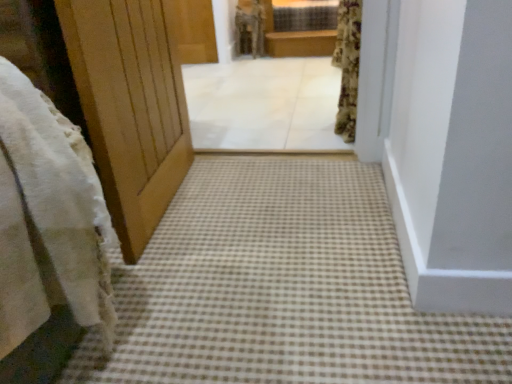
What do you see at coordinates (348, 66) in the screenshot? The height and width of the screenshot is (384, 512). I see `fluffy floral curtain at upper right` at bounding box center [348, 66].

Locate an element on the screen. white fluffy robe at upper center is located at coordinates (249, 28).

What are the coordinates of `white tile floor at center` in the screenshot? It's located at (264, 104).

Identify the location of plaid fabric window at upper center. This screenshot has height=384, width=512. (304, 15).

What is the approximate width of brown checkered carpet at center?

The width of brown checkered carpet at center is 1.49 meters.

The width and height of the screenshot is (512, 384). Identify the location of brown wooden balustrade at upper center. (300, 43).

Identify the location of fluffy floral curtain at upper right. (348, 66).

Is brown wooden balustrade at upper center far from brown checkered carpet at center?

Yes.

Choose the correct answer: Is brown wooden balustrade at upper center inside brown checkered carpet at center or outside it?

brown wooden balustrade at upper center is not inside brown checkered carpet at center, it's outside.

The width and height of the screenshot is (512, 384). I want to click on path below the brown wooden balustrade at upper center (from a real-world perspective), so click(x=283, y=288).

Can you confirm if brown wooden balustrade at upper center is bigger than brown checkered carpet at center?

Actually, brown wooden balustrade at upper center might be smaller than brown checkered carpet at center.

From a real-world perspective, is plaid fabric window at upper center under fluffy floral curtain at upper right?

No, from a real-world perspective, plaid fabric window at upper center is not below fluffy floral curtain at upper right.

Is plaid fabric window at upper center positioned beyond the bounds of fluffy floral curtain at upper right?

Absolutely, plaid fabric window at upper center is external to fluffy floral curtain at upper right.

The height and width of the screenshot is (384, 512). Find the location of `curtain below the plaid fabric window at upper center (from the image's perspective)`. curtain below the plaid fabric window at upper center (from the image's perspective) is located at coordinates (348, 66).

Considering their positions, is plaid fabric window at upper center located in front of or behind fluffy floral curtain at upper right?

Visually, plaid fabric window at upper center is located behind fluffy floral curtain at upper right.

Locate an element on the screen. The height and width of the screenshot is (384, 512). corridor below the brown wooden balustrade at upper center (from the image's perspective) is located at coordinates (264, 104).

Is brown wooden balustrade at upper center outside of white tile floor at center?

Yes.

Does brown wooden balustrade at upper center touch white tile floor at center?

brown wooden balustrade at upper center is not next to white tile floor at center, and they're not touching.

From the picture: Between brown wooden balustrade at upper center and white tile floor at center, which one has more height?

brown wooden balustrade at upper center.

In the scene shown: Can we say white tile floor at center lies outside brown checkered carpet at center?

Yes.

From a real-world perspective, between white tile floor at center and brown checkered carpet at center, who is vertically lower?

From a 3D spatial view, brown checkered carpet at center is below.

Identify the location of path on the right of white tile floor at center. The width and height of the screenshot is (512, 384). (283, 288).

Does white tile floor at center lie behind brown checkered carpet at center?

Yes, white tile floor at center is further from the viewer.

How distant is white tile floor at center from brown wooden balustrade at upper center?

white tile floor at center and brown wooden balustrade at upper center are 37.37 inches apart from each other.

Can you confirm if white tile floor at center is shorter than brown wooden balustrade at upper center?

Yes, white tile floor at center is shorter than brown wooden balustrade at upper center.

Is white tile floor at center inside the boundaries of brown wooden balustrade at upper center, or outside?

white tile floor at center is not inside brown wooden balustrade at upper center, it's outside.

Considering the positions of point (274, 142) and point (286, 36), is point (274, 142) closer or farther from the camera than point (286, 36)?

Point (274, 142) is positioned closer to the camera compared to point (286, 36).

The image size is (512, 384). In order to click on window that is above the white fluffy robe at upper center (from a real-world perspective) in this screenshot , I will do `click(304, 15)`.

Measure the distance from white fluffy robe at upper center to plaid fabric window at upper center.

12.41 inches.

Which object is positioned more to the left, white fluffy robe at upper center or plaid fabric window at upper center?

From the viewer's perspective, white fluffy robe at upper center appears more on the left side.

Which is correct: white fluffy robe at upper center is inside plaid fabric window at upper center, or outside of it?

white fluffy robe at upper center cannot be found inside plaid fabric window at upper center.

Could plaid fabric window at upper center be considered to be inside white tile floor at center?

That's incorrect, plaid fabric window at upper center is not inside white tile floor at center.

Which is nearer, (230, 123) or (329, 3)?

Point (230, 123) appears to be closer to the viewer than point (329, 3).

Considering the positions of objects white tile floor at center and plaid fabric window at upper center in the image provided, who is more to the left, white tile floor at center or plaid fabric window at upper center?

white tile floor at center.

What's the angular difference between white tile floor at center and plaid fabric window at upper center's facing directions?

white tile floor at center and plaid fabric window at upper center are facing 0.337 degrees away from each other.

The height and width of the screenshot is (384, 512). In order to click on balustrade located above the brown checkered carpet at center (from a real-world perspective) in this screenshot , I will do `click(300, 43)`.

Identify the location of window behind the fluffy floral curtain at upper right. (304, 15).

Considering their positions, is white tile floor at center positioned closer to fluffy floral curtain at upper right than brown wooden balustrade at upper center?

The object closer to fluffy floral curtain at upper right is white tile floor at center.

Considering their positions, is white tile floor at center positioned closer to plaid fabric window at upper center than fluffy floral curtain at upper right?

white tile floor at center.

When comparing their distances from fluffy floral curtain at upper right, does white tile floor at center or brown checkered carpet at center seem closer?

Among the two, white tile floor at center is located nearer to fluffy floral curtain at upper right.

Estimate the real-world distances between objects in this image. Which object is further from white tile floor at center, brown wooden balustrade at upper center or white fluffy robe at upper center?

white fluffy robe at upper center is positioned further to the anchor white tile floor at center.

Considering their positions, is white fluffy robe at upper center positioned closer to plaid fabric window at upper center than brown checkered carpet at center?

white fluffy robe at upper center lies closer to plaid fabric window at upper center than the other object.

Estimate the real-world distances between objects in this image. Which object is further from white tile floor at center, brown checkered carpet at center or brown wooden balustrade at upper center?

brown checkered carpet at center is positioned further to the anchor white tile floor at center.

Based on their spatial positions, is brown checkered carpet at center or plaid fabric window at upper center further from brown wooden balustrade at upper center?

brown checkered carpet at center is positioned further to the anchor brown wooden balustrade at upper center.

Looking at the image, which one is located closer to white fluffy robe at upper center, brown wooden balustrade at upper center or plaid fabric window at upper center?

brown wooden balustrade at upper center is positioned closer to the anchor white fluffy robe at upper center.

Identify the location of corridor between brown checkered carpet at center and plaid fabric window at upper center along the z-axis. This screenshot has width=512, height=384. (264, 104).

What are the coordinates of `corridor located between fluffy floral curtain at upper right and brown wooden balustrade at upper center in the depth direction` in the screenshot? It's located at (264, 104).

You are a GUI agent. You are given a task and a screenshot of the screen. Output one action in this format:
    pyautogui.click(x=<x>, y=<y>)
    Task: Click on the corridor between brown checkered carpet at center and brown wooden balustrade at upper center from front to back
    
    Given the screenshot: What is the action you would take?
    pyautogui.click(x=264, y=104)

The width and height of the screenshot is (512, 384). Identify the location of curtain between brown checkered carpet at center and white fluffy robe at upper center from front to back. (348, 66).